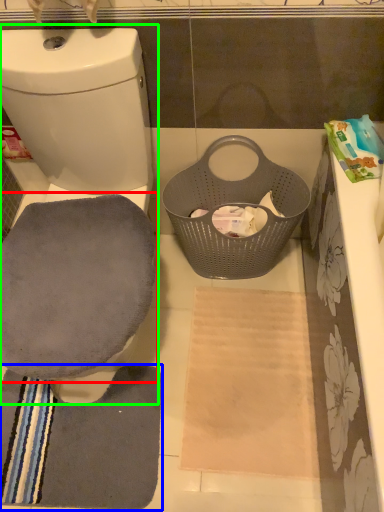
Question: Estimate the real-world distances between objects in this image. Which object is closer to swivel chair (highlighted by a red box), bath towel (highlighted by a blue box) or toilet (highlighted by a green box)?

Choices:
 (A) bath towel
 (B) toilet

Answer: (B)